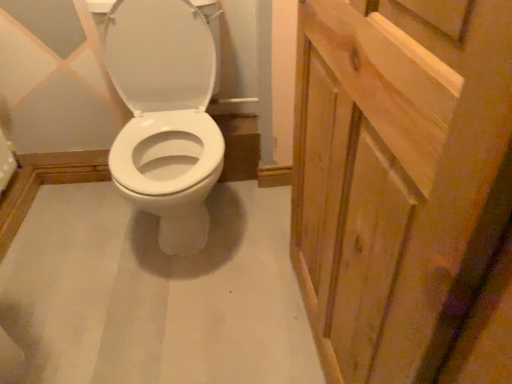
Image resolution: width=512 pixels, height=384 pixels. Describe the element at coordinates (398, 176) in the screenshot. I see `natural wood screen door at right` at that location.

Locate an element on the screen. The image size is (512, 384). natural wood screen door at right is located at coordinates (398, 176).

What do you see at coordinates (165, 115) in the screenshot?
I see `white glossy toilet seat at left` at bounding box center [165, 115].

Find the location of a particular element. white glossy toilet seat at left is located at coordinates (165, 115).

Locate an element on the screen. natural wood screen door at right is located at coordinates (398, 176).

From the picture: Which is more to the left, natural wood screen door at right or white glossy toilet seat at left?

white glossy toilet seat at left is more to the left.

Is the position of natural wood screen door at right more distant than that of white glossy toilet seat at left?

No.

Which is nearer, [433,213] or [193,46]?

The point [433,213] is in front.

From the image's perspective, who appears lower, natural wood screen door at right or white glossy toilet seat at left?

natural wood screen door at right appears lower in the image.

From a real-world perspective, is natural wood screen door at right above or below white glossy toilet seat at left?

In terms of real-world spatial position, natural wood screen door at right is above white glossy toilet seat at left.

Which object is wider, natural wood screen door at right or white glossy toilet seat at left?

white glossy toilet seat at left.

Can you confirm if natural wood screen door at right is shorter than white glossy toilet seat at left?

Incorrect, the height of natural wood screen door at right does not fall short of that of white glossy toilet seat at left.

Who is smaller, natural wood screen door at right or white glossy toilet seat at left?

With smaller size is natural wood screen door at right.

Is white glossy toilet seat at left located within natural wood screen door at right?

Definitely not — white glossy toilet seat at left is not inside natural wood screen door at right.

Is natural wood screen door at right touching white glossy toilet seat at left?

No, natural wood screen door at right is not with white glossy toilet seat at left.

Could you tell me if natural wood screen door at right is turned towards white glossy toilet seat at left?

No, natural wood screen door at right does not turn towards white glossy toilet seat at left.

This screenshot has height=384, width=512. I want to click on screen door in front of the white glossy toilet seat at left, so click(x=398, y=176).

In the image, is white glossy toilet seat at left on the left side or the right side of natural wood screen door at right?

white glossy toilet seat at left is positioned on natural wood screen door at right's left side.

Is white glossy toilet seat at left positioned in front of natural wood screen door at right?

No, white glossy toilet seat at left is behind natural wood screen door at right.

Is point (130, 140) less distant than point (313, 98)?

No.

From the image's perspective, who appears lower, white glossy toilet seat at left or natural wood screen door at right?

natural wood screen door at right.

From a real-world perspective, which is physically above, white glossy toilet seat at left or natural wood screen door at right?

natural wood screen door at right is physically above.

Does white glossy toilet seat at left have a greater width compared to natural wood screen door at right?

Yes.

Is white glossy toilet seat at left taller or shorter than natural wood screen door at right?

Clearly, white glossy toilet seat at left is shorter compared to natural wood screen door at right.

Looking at this image, considering the relative sizes of white glossy toilet seat at left and natural wood screen door at right in the image provided, is white glossy toilet seat at left bigger than natural wood screen door at right?

Indeed, white glossy toilet seat at left has a larger size compared to natural wood screen door at right.

Is white glossy toilet seat at left completely or partially outside of natural wood screen door at right?

Yes, white glossy toilet seat at left is located beyond the bounds of natural wood screen door at right.

Are white glossy toilet seat at left and natural wood screen door at right far apart?

No.

Is white glossy toilet seat at left facing away from natural wood screen door at right?

No, white glossy toilet seat at left is not facing the opposite direction of natural wood screen door at right.

How distant is white glossy toilet seat at left from natural wood screen door at right?

white glossy toilet seat at left and natural wood screen door at right are 25.07 inches apart.

In the image, there is a natural wood screen door at right. Find the location of `sit above it (from the image's perspective)`. sit above it (from the image's perspective) is located at coordinates (165, 115).

This screenshot has height=384, width=512. What are the coordinates of `sit behind the natural wood screen door at right` in the screenshot? It's located at (165, 115).

I want to click on sit located on the left of natural wood screen door at right, so click(x=165, y=115).